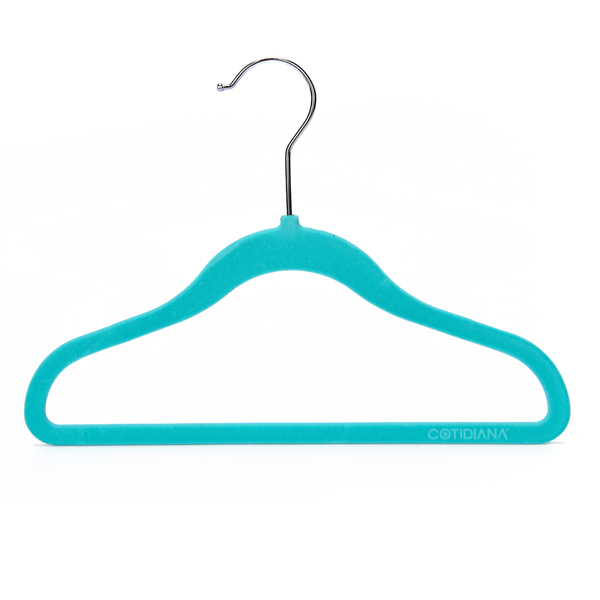
Find the location of a particular element. This screenshot has height=600, width=600. far left point of hanger is located at coordinates (28, 412).